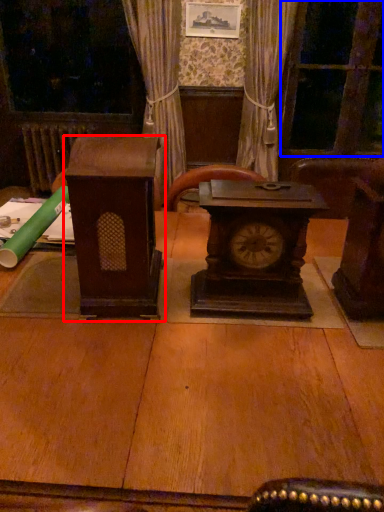
Question: Which of the following is the closest to the observer, furniture (highlighted by a red box) or glass door (highlighted by a blue box)?

Choices:
 (A) furniture
 (B) glass door

Answer: (A)